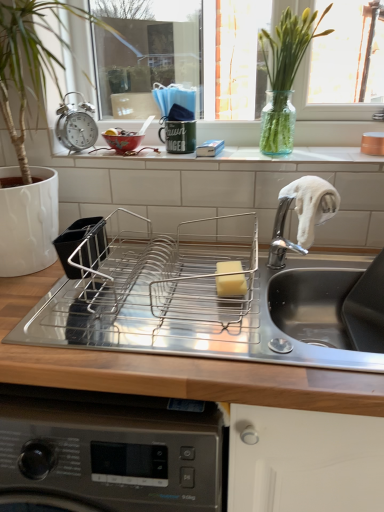
This screenshot has height=512, width=384. Identify the location of vacant space situated on the left part of yellow sponge at center. click(169, 295).